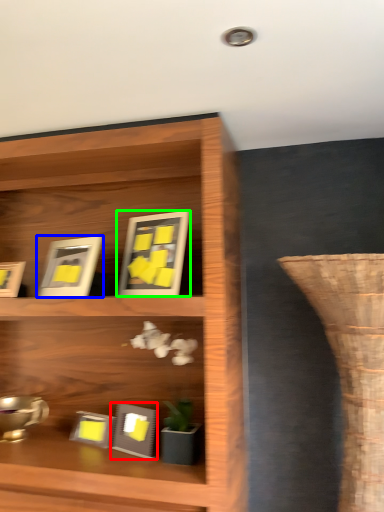
Question: Which object is the farthest from picture frame (highlighted by a red box)? Choose among these: picture frame (highlighted by a blue box) or picture frame (highlighted by a green box).

Choices:
 (A) picture frame
 (B) picture frame

Answer: (B)